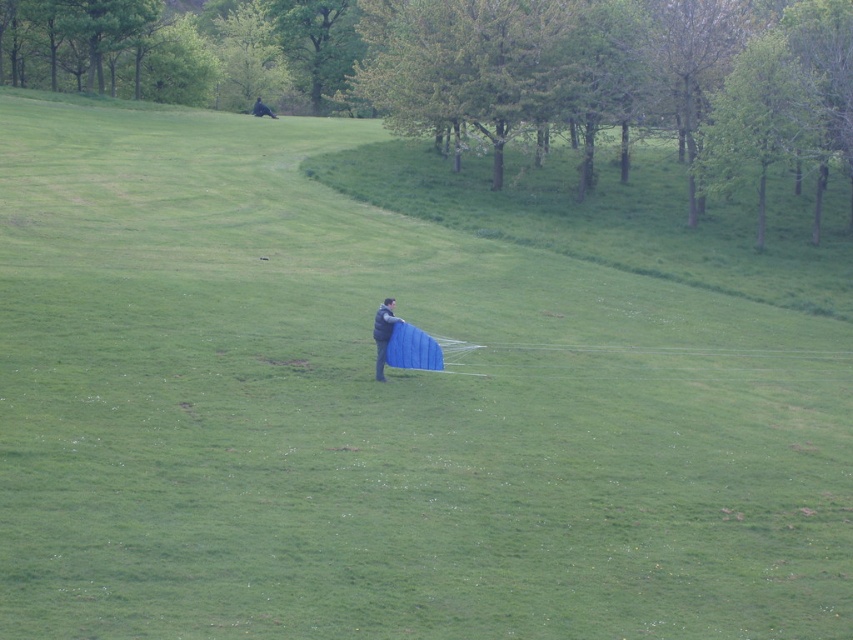
Question: Is green leafy tree at upper center above dark gray fabric kite at center?

Choices:
 (A) yes
 (B) no

Answer: (A)

Question: Which of the following is the farthest from the observer?

Choices:
 (A) green leafy tree at upper center
 (B) dark blue fabric at upper center
 (C) dark gray fabric kite at center

Answer: (B)

Question: Which point is farther to the camera?

Choices:
 (A) (374, 323)
 (B) (270, 113)

Answer: (B)

Question: In this image, where is green leafy tree at upper center located relative to dark gray fabric kite at center?

Choices:
 (A) below
 (B) above

Answer: (B)

Question: Does green leafy tree at upper center appear over dark gray fabric kite at center?

Choices:
 (A) no
 (B) yes

Answer: (B)

Question: Among these objects, which one is farthest from the camera?

Choices:
 (A) dark gray fabric kite at center
 (B) dark blue fabric at upper center

Answer: (B)